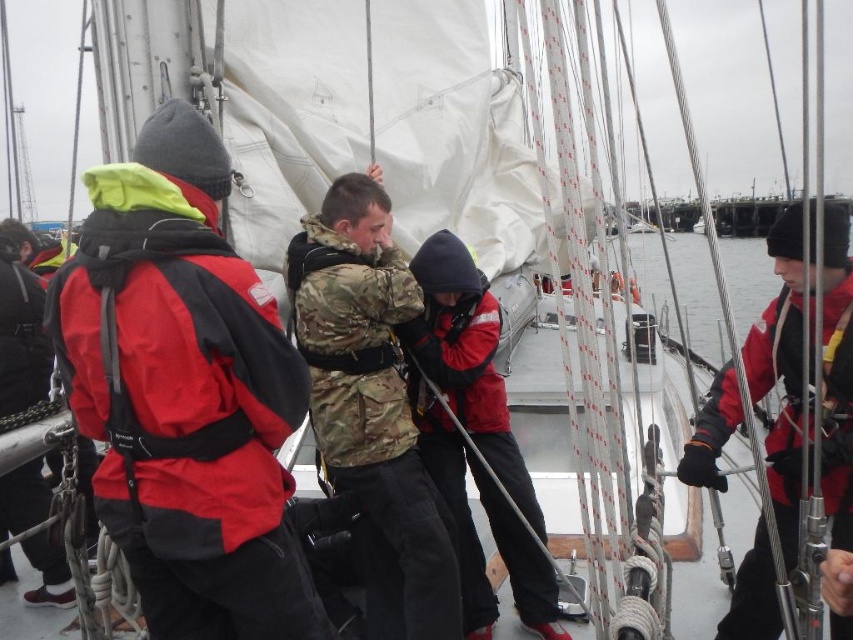
Question: Among these objects, which one is nearest to the camera?

Choices:
 (A) red matte life jacket at center
 (B) matte black jacket at center

Answer: (B)

Question: Which object appears closest to the camera in this image?

Choices:
 (A) red matte life jacket at center
 (B) red matte jacket at right
 (C) red matte jacket at left

Answer: (C)

Question: Can you confirm if matte black jacket at center is positioned below red matte life jacket at center?

Choices:
 (A) yes
 (B) no

Answer: (A)

Question: Is camo fabric jacket at center to the left of red matte life jacket at center from the viewer's perspective?

Choices:
 (A) no
 (B) yes

Answer: (B)

Question: Among these objects, which one is nearest to the camera?

Choices:
 (A) red matte jacket at right
 (B) red matte life jacket at center
 (C) camo fabric jacket at center

Answer: (A)

Question: Is camo fabric jacket at center smaller than matte black jacket at center?

Choices:
 (A) yes
 (B) no

Answer: (A)